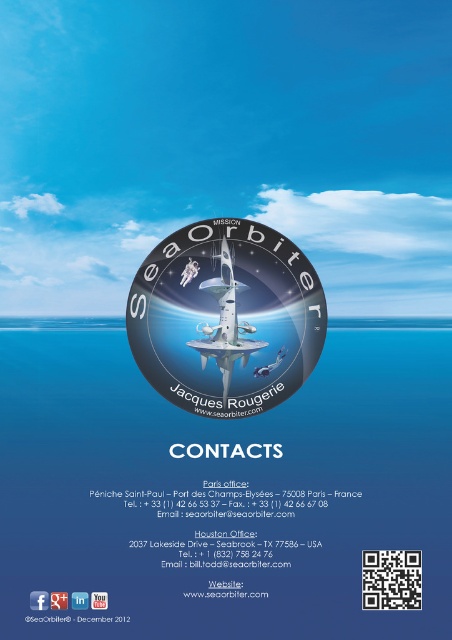
Question: Is glossy metallic seaorbiter at center behind white glossy rocket at center?

Choices:
 (A) yes
 (B) no

Answer: (B)

Question: Does glossy metallic seaorbiter at center appear on the left side of white glossy rocket at center?

Choices:
 (A) no
 (B) yes

Answer: (B)

Question: In this image, where is glossy metallic seaorbiter at center located relative to white glossy rocket at center?

Choices:
 (A) right
 (B) left

Answer: (B)

Question: Which point is closer to the camera?

Choices:
 (A) glossy metallic seaorbiter at center
 (B) white glossy rocket at center

Answer: (A)